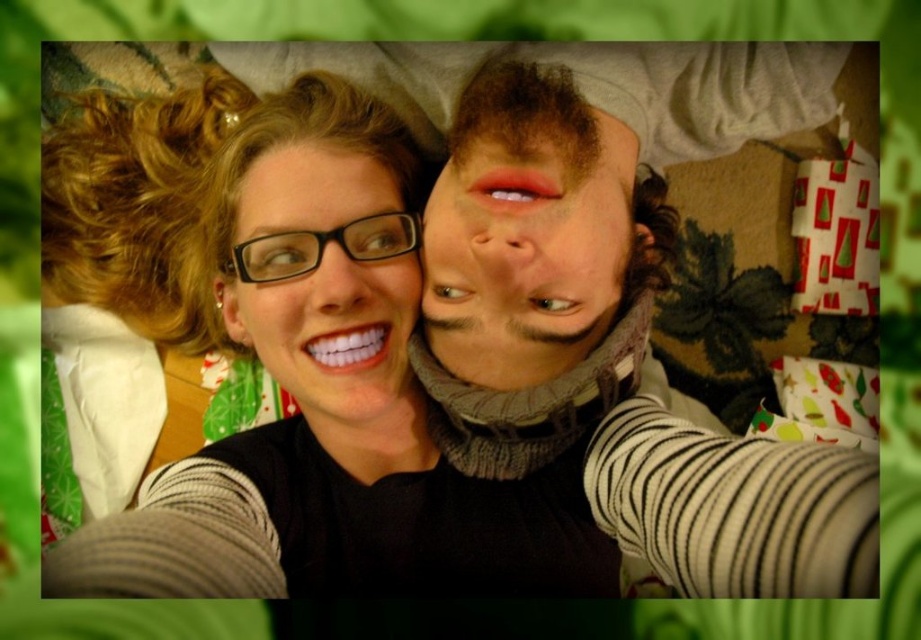
You are a photographer trying to capture a close shot of both matte black glasses at upper left and matte black glasses at center in the image. Given that your camera can only focus on objects within a 1.5 inch range, will you be able to capture both glasses clearly in the same frame?

The matte black glasses at upper left is 1.64 inches from matte black glasses at center, which exceeds the camera focus range of 1.5 inches. Therefore, you won me to capture both glasses clearly in the same frame.

You are trying to locate the matte black glasses at upper left and the matte black glasses at center in the image. Which one is positioned further to the left?

The matte black glasses at upper left is positioned to the left of the matte black glasses at center, so it is further to the left.

You are a photographer adjusting the focus on your camera. You want to ensure both the matte gray sweater at center and the matte black glasses at center are in sharp focus. The camera has a depth of field that can cover objects within a 10 cm range. Can both objects be in focus simultaneously?

The matte gray sweater at center and the matte black glasses at center are 10.34 centimeters apart. Since the depth of field can only cover 10 cm, the distance between them exceeds this range. Therefore, both objects cannot be in focus simultaneously.